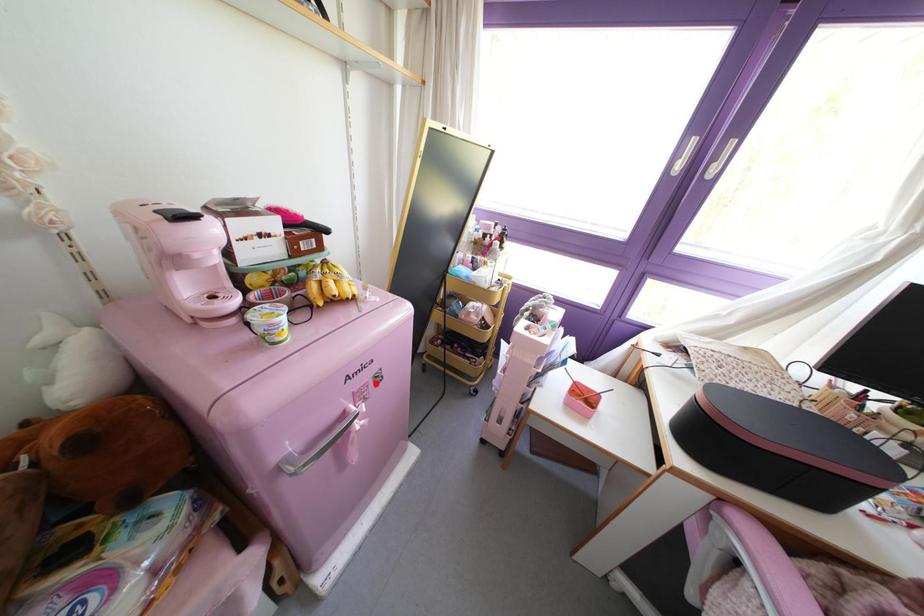
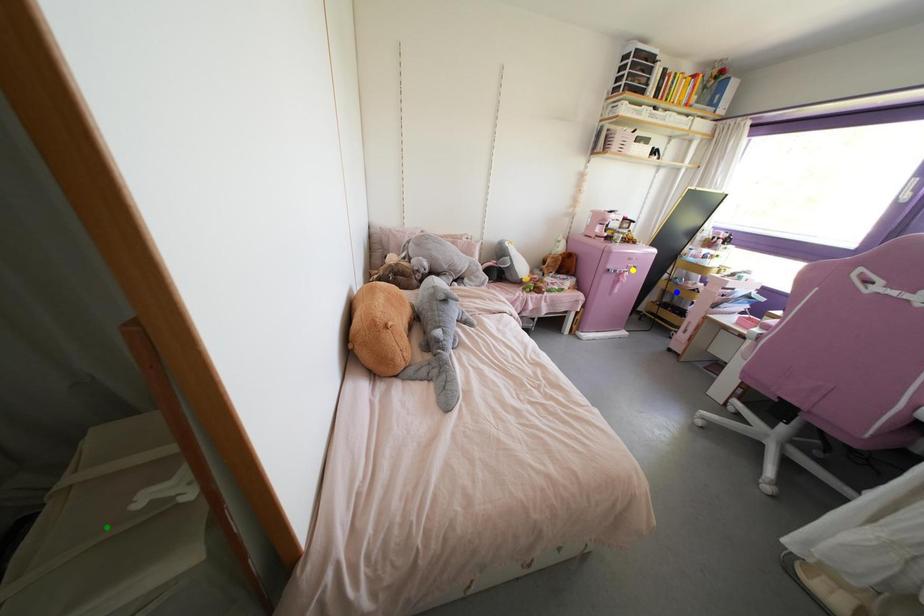
Question: I am providing you with two images of the same scene from different viewpoints. A red point is marked on the first image. You are given multiple points on the second image. Which point in image 2 is actually the same real-world point as the red point in image 1?

Choices:
 (A) green point
 (B) yellow point
 (C) blue point

Answer: (B)